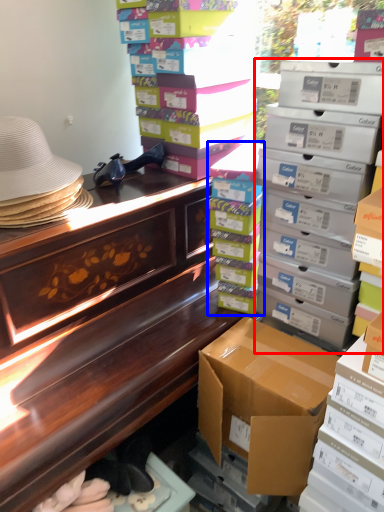
Question: Which of the following is the farthest to the observer, box (highlighted by a red box) or box (highlighted by a blue box)?

Choices:
 (A) box
 (B) box

Answer: (B)